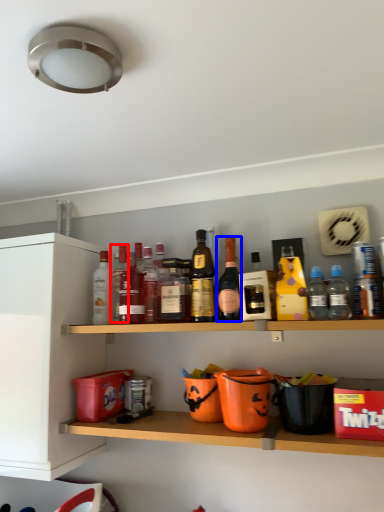
Question: Which object is closer to the camera taking this photo, bottle (highlighted by a red box) or bottle (highlighted by a blue box)?

Choices:
 (A) bottle
 (B) bottle

Answer: (B)